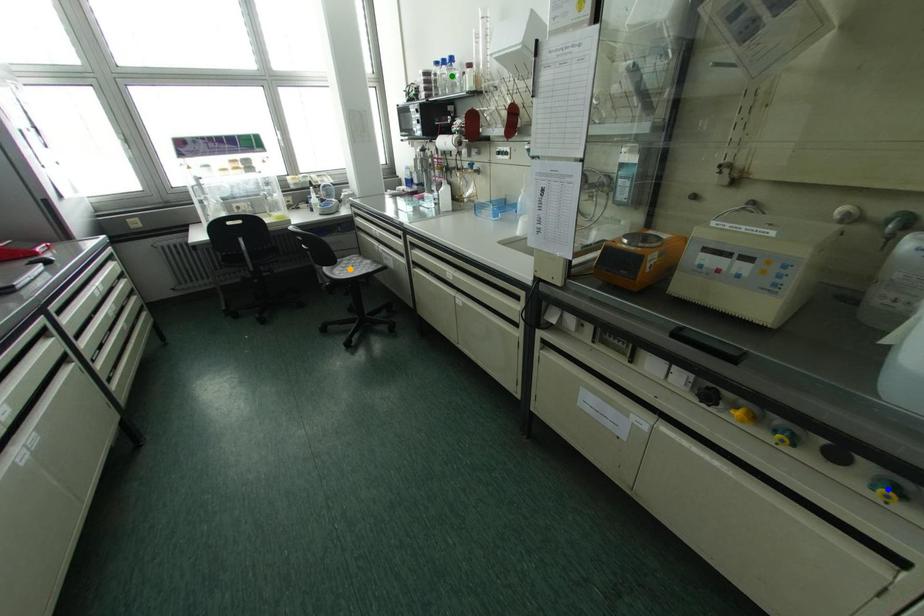
Order these from farthest to nearest:
- orange point
- green point
- blue point

green point < orange point < blue point